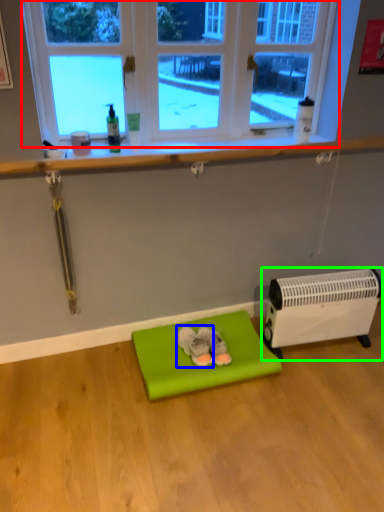
Question: Which object is the closest to the window (highlighted by a red box)? Choose among these: footwear (highlighted by a blue box) or heater (highlighted by a green box).

Choices:
 (A) footwear
 (B) heater

Answer: (B)